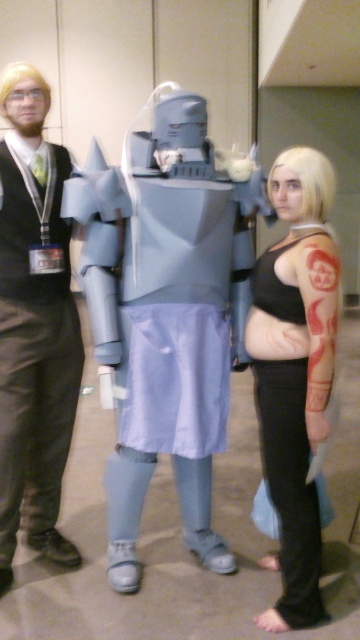
Who is more distant from viewer, (3, 224) or (312, 337)?

Positioned behind is point (3, 224).

This screenshot has height=640, width=360. In order to click on brushed metal vest at left in this screenshot , I will do `click(33, 324)`.